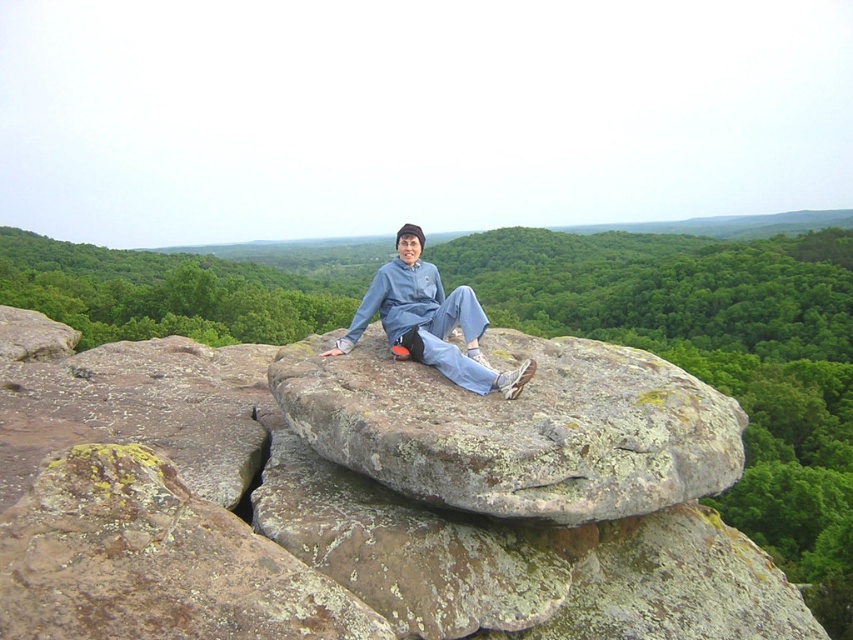
Question: Where is gray lichen-covered rock at center located in relation to blue denim pants at center in the image?

Choices:
 (A) left
 (B) right

Answer: (B)

Question: Estimate the real-world distances between objects in this image. Which object is closer to the gray lichen-covered rock at center?

Choices:
 (A) blue denim pants at center
 (B) lichen-covered rock at center

Answer: (A)

Question: Can you confirm if gray lichen-covered rock at center is smaller than blue denim pants at center?

Choices:
 (A) yes
 (B) no

Answer: (B)

Question: Estimate the real-world distances between objects in this image. Which object is farther from the blue denim pants at center?

Choices:
 (A) matte blue sweatshirt at center
 (B) gray lichen-covered rock at center

Answer: (B)

Question: Which object is positioned closest to the gray lichen-covered rock at center?

Choices:
 (A) lichen-covered rock at center
 (B) blue denim pants at center
 (C) matte blue sweatshirt at center

Answer: (B)

Question: Is blue denim pants at center smaller than matte blue sweatshirt at center?

Choices:
 (A) yes
 (B) no

Answer: (A)